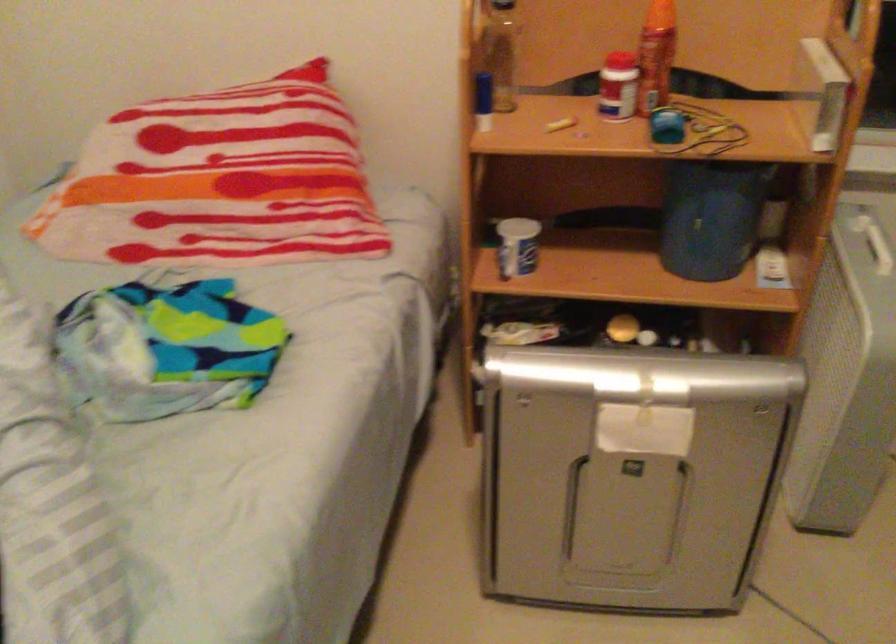
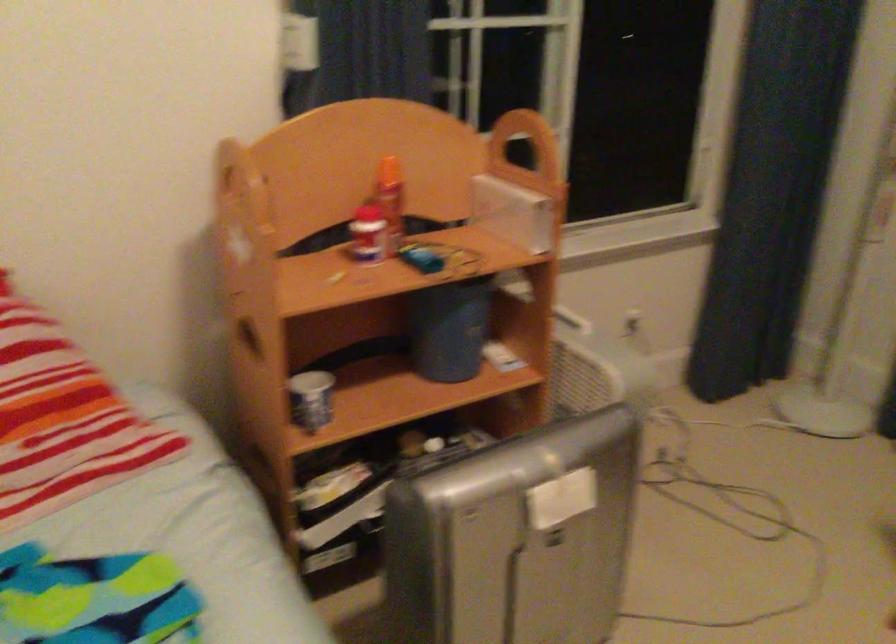
The point at (690, 216) is marked in the first image. Where is the corresponding point in the second image?

(449, 328)